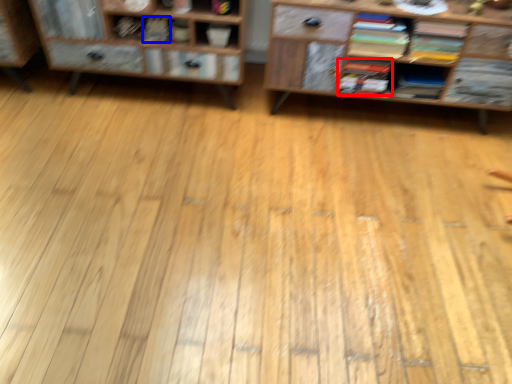
Question: Which object appears closest to the camera in this image, book (highlighted by a red box) or book (highlighted by a blue box)?

Choices:
 (A) book
 (B) book

Answer: (A)